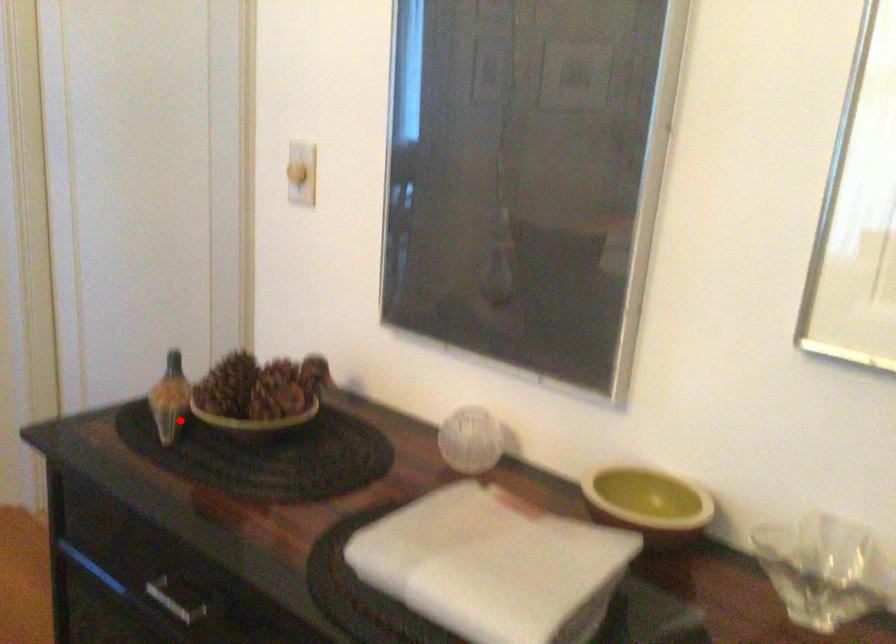
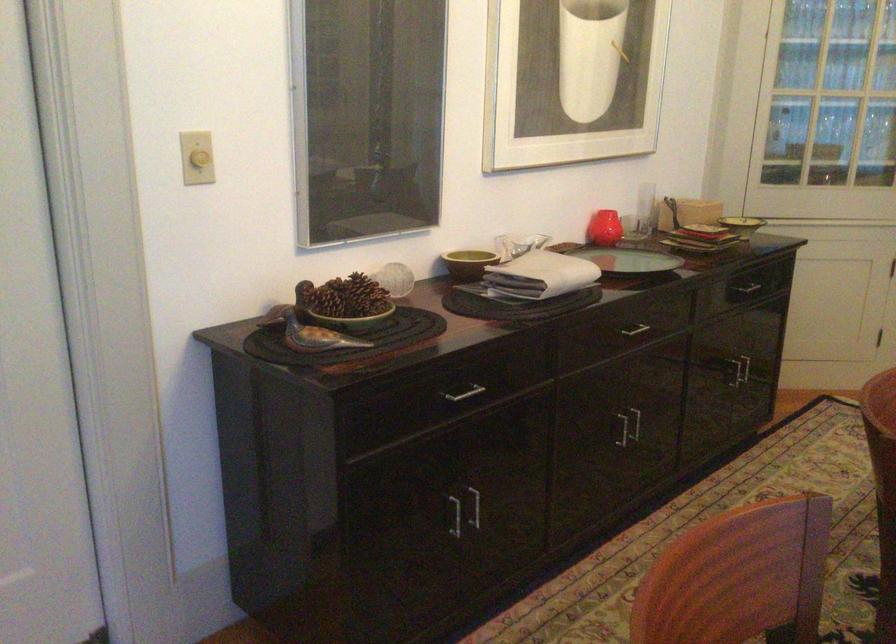
Where in the second image is the point corresponding to the highlighted location from the first image?

(312, 333)